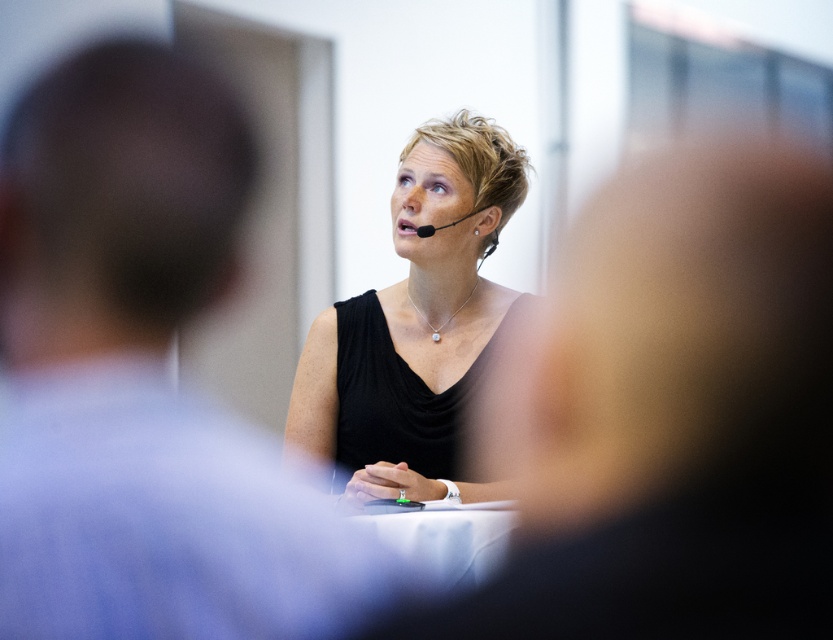
Question: Does black matte dress at center appear on the left side of matte black face at center?

Choices:
 (A) yes
 (B) no

Answer: (A)

Question: Is black matte dress at center smaller than matte black face at center?

Choices:
 (A) yes
 (B) no

Answer: (B)

Question: Which point is closer to the camera?

Choices:
 (A) matte black face at center
 (B) black matte dress at center

Answer: (B)

Question: Is black matte dress at center to the left of matte black face at center from the viewer's perspective?

Choices:
 (A) no
 (B) yes

Answer: (B)

Question: Which point appears closest to the camera in this image?

Choices:
 (A) (308, 365)
 (B) (455, 195)

Answer: (B)

Question: Which point is closer to the camera?

Choices:
 (A) matte black face at center
 (B) black matte dress at center

Answer: (B)